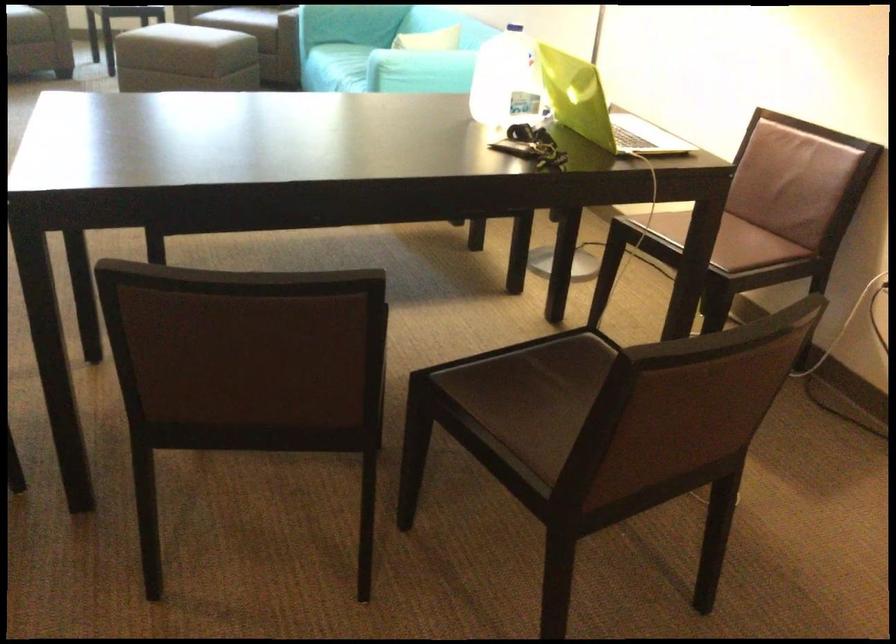
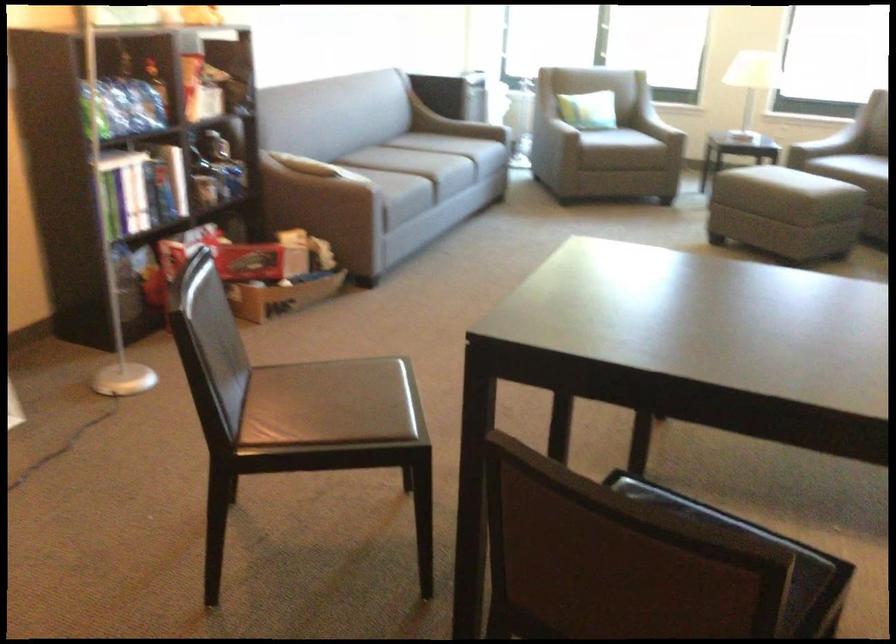
Question: Which direction would the cameraman need to move to produce the second image? Reply with the corresponding letter.

Choices:
 (A) Left
 (B) Right
 (C) Forward
 (D) Backward

Answer: (D)